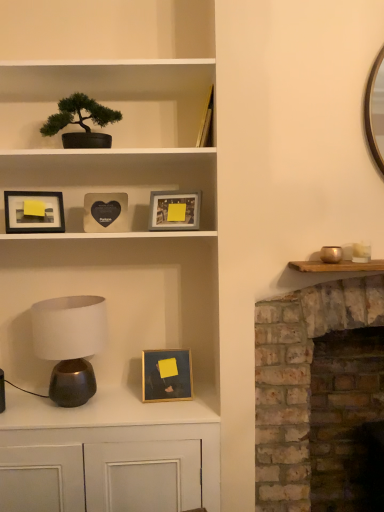
Where is `vacant area that lies between satin white lampshade at lower left and gold/glossy picture frame at center, the 4th picture frame in the top-to-bottom sequence`? vacant area that lies between satin white lampshade at lower left and gold/glossy picture frame at center, the 4th picture frame in the top-to-bottom sequence is located at coordinates (130, 406).